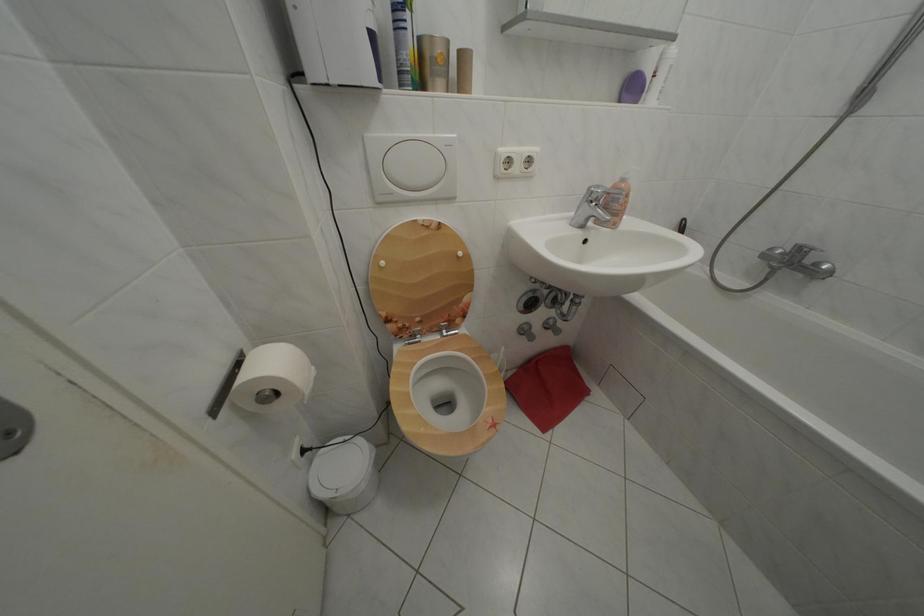
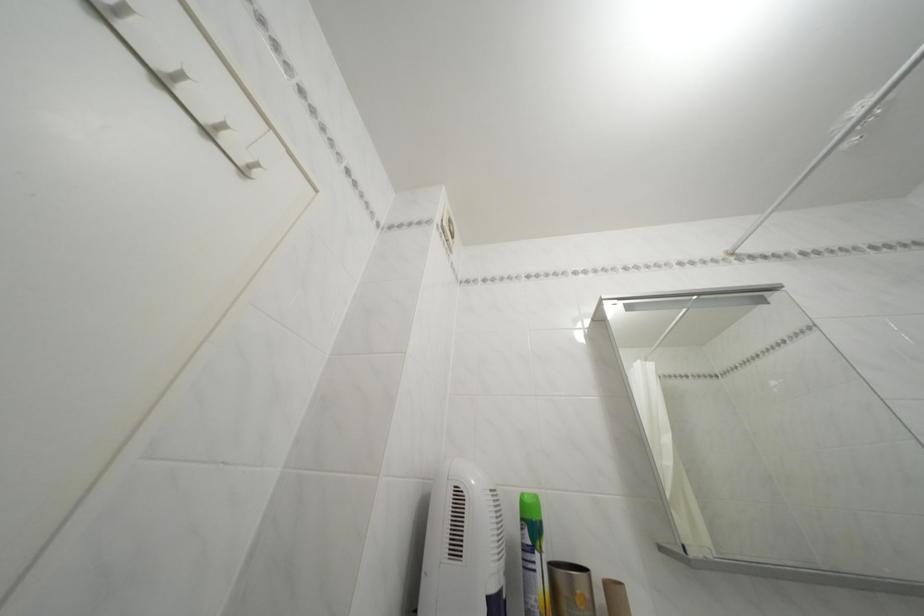
First-person continuous shooting, in which direction is the camera rotating?

The camera's rotation is toward left-up.